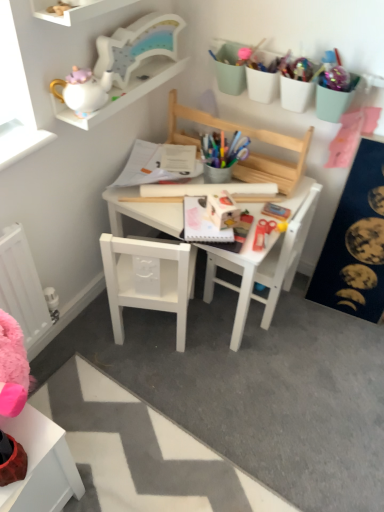
Question: From the image's perspective, would you say dark blue fabric bulletin board at right is positioned over pastel green plastic containers at upper right, marked as the 1th stationery in a right-to-left arrangement?

Choices:
 (A) no
 (B) yes

Answer: (A)

Question: Is dark blue fabric bulletin board at right oriented away from pastel green plastic containers at upper right, the 1th stationery from the back?

Choices:
 (A) yes
 (B) no

Answer: (B)

Question: From the image's perspective, is dark blue fabric bulletin board at right below pastel green plastic containers at upper right, marked as the 1th stationery in a right-to-left arrangement?

Choices:
 (A) no
 (B) yes

Answer: (B)

Question: Would you consider dark blue fabric bulletin board at right to be distant from pastel green plastic containers at upper right, positioned as the 2th stationery in left-to-right order?

Choices:
 (A) no
 (B) yes

Answer: (A)

Question: Considering the relative sizes of dark blue fabric bulletin board at right and pastel green plastic containers at upper right, the 1th stationery from the back, in the image provided, is dark blue fabric bulletin board at right smaller than pastel green plastic containers at upper right, the 1th stationery from the back,?

Choices:
 (A) no
 (B) yes

Answer: (A)

Question: Does dark blue fabric bulletin board at right appear on the right side of pastel green plastic containers at upper right, marked as the 1th stationery in a right-to-left arrangement?

Choices:
 (A) no
 (B) yes

Answer: (B)

Question: Can you confirm if white matte chair at lower left, the 1th chair from the left, is thinner than dark blue fabric bulletin board at right?

Choices:
 (A) no
 (B) yes

Answer: (A)

Question: Is white matte chair at lower left, the 1th chair from the left, not inside dark blue fabric bulletin board at right?

Choices:
 (A) no
 (B) yes

Answer: (B)

Question: From the image's perspective, is white matte chair at lower left, the 1th chair from the left, above dark blue fabric bulletin board at right?

Choices:
 (A) no
 (B) yes

Answer: (A)

Question: Does white matte chair at lower left, the 1th chair from the left, have a smaller size compared to dark blue fabric bulletin board at right?

Choices:
 (A) no
 (B) yes

Answer: (A)

Question: Considering the relative sizes of white matte chair at lower left, placed as the 2th chair when sorted from right to left, and dark blue fabric bulletin board at right in the image provided, is white matte chair at lower left, placed as the 2th chair when sorted from right to left, taller than dark blue fabric bulletin board at right?

Choices:
 (A) yes
 (B) no

Answer: (B)

Question: Could you tell me if white matte chair at lower left, the 1th chair from the left, is turned towards dark blue fabric bulletin board at right?

Choices:
 (A) no
 (B) yes

Answer: (A)

Question: From a real-world perspective, is white wooden shelf at upper left, placed as the second shelf when sorted from back to front, located beneath white glossy teapot at upper left, the first stationery positioned from the front?

Choices:
 (A) no
 (B) yes

Answer: (A)